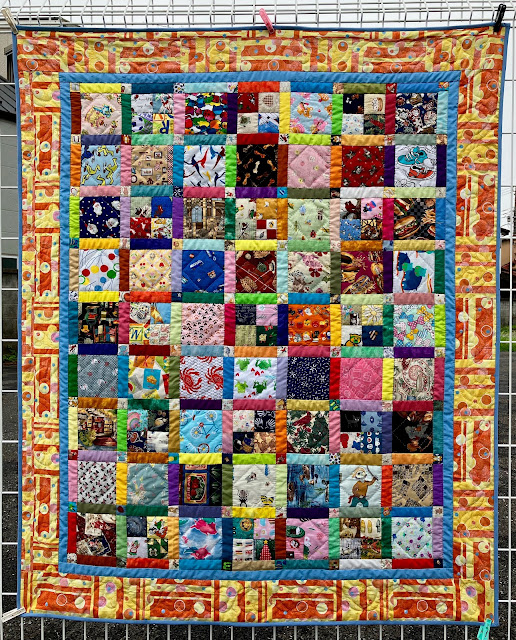
Where is `drying rack`? This screenshot has width=516, height=640. drying rack is located at coordinates (123, 13), (9, 594), (503, 550).